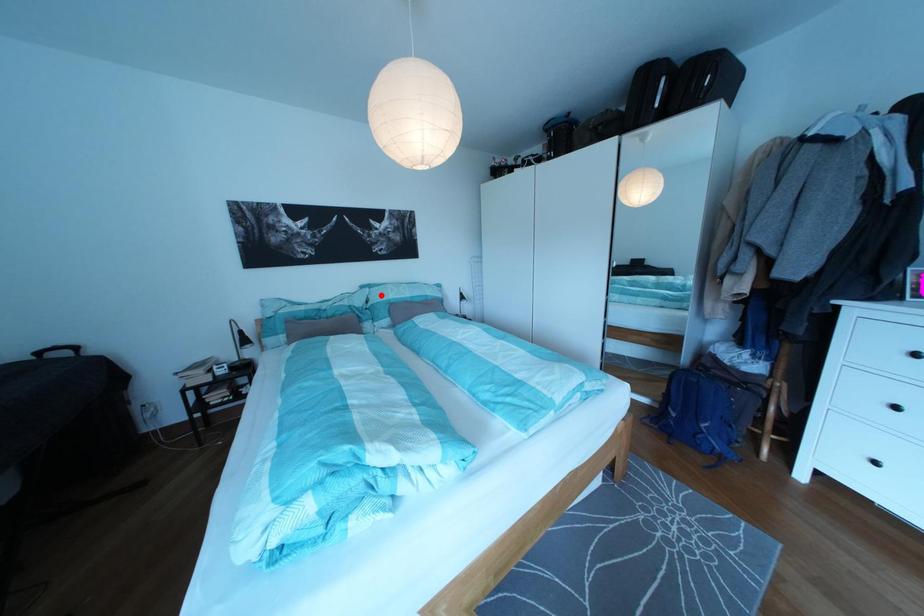
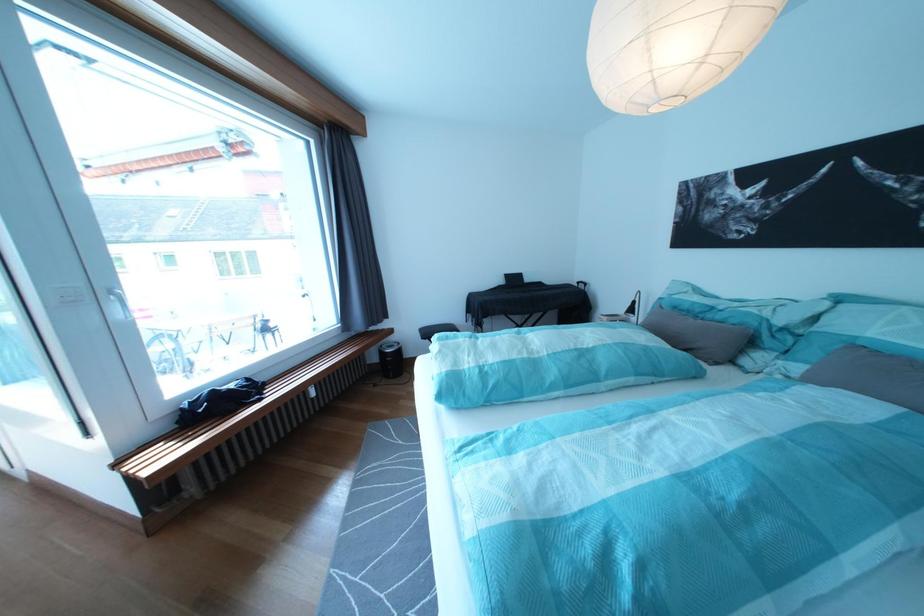
Where in the second image is the point corresponding to the highlighted location from the first image?

(841, 309)